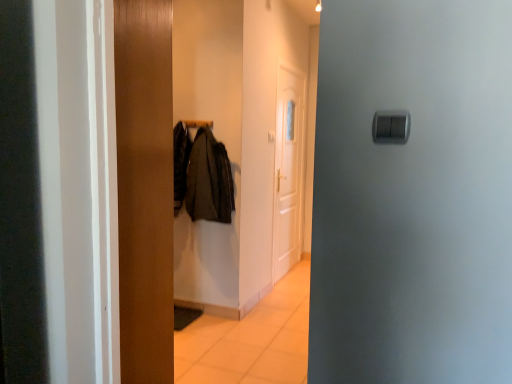
This screenshot has width=512, height=384. Find the location of `free location in front of white glossy door at center, which appears as the second door when viewed from the front`. free location in front of white glossy door at center, which appears as the second door when viewed from the front is located at coordinates (289, 285).